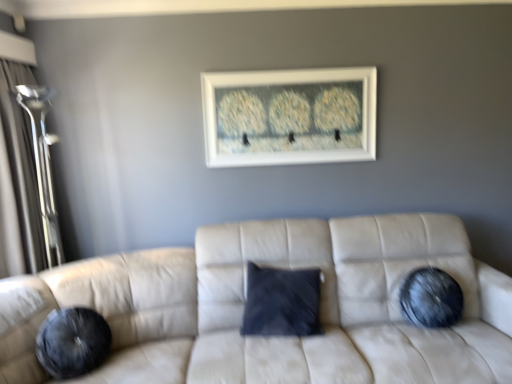
Question: Is transparent glass door at left oriented towards white matte picture frame at upper center?

Choices:
 (A) yes
 (B) no

Answer: (A)

Question: From the image's perspective, is transparent glass door at left above white matte picture frame at upper center?

Choices:
 (A) yes
 (B) no

Answer: (B)

Question: Is transparent glass door at left to the left of white matte picture frame at upper center from the viewer's perspective?

Choices:
 (A) no
 (B) yes

Answer: (B)

Question: Is transparent glass door at left to the right of white matte picture frame at upper center from the viewer's perspective?

Choices:
 (A) no
 (B) yes

Answer: (A)

Question: Is the position of transparent glass door at left less distant than that of white matte picture frame at upper center?

Choices:
 (A) no
 (B) yes

Answer: (B)

Question: Are transparent glass door at left and white matte picture frame at upper center making contact?

Choices:
 (A) no
 (B) yes

Answer: (A)

Question: Does white matte picture frame at upper center have a lesser height compared to suede beige couch at center?

Choices:
 (A) yes
 (B) no

Answer: (A)

Question: Is white matte picture frame at upper center located outside suede beige couch at center?

Choices:
 (A) no
 (B) yes

Answer: (B)

Question: Considering the relative sizes of white matte picture frame at upper center and suede beige couch at center in the image provided, is white matte picture frame at upper center bigger than suede beige couch at center?

Choices:
 (A) no
 (B) yes

Answer: (A)

Question: From a real-world perspective, is white matte picture frame at upper center located beneath suede beige couch at center?

Choices:
 (A) yes
 (B) no

Answer: (B)

Question: From the image's perspective, would you say white matte picture frame at upper center is positioned over suede beige couch at center?

Choices:
 (A) no
 (B) yes

Answer: (B)

Question: Considering the relative positions of white matte picture frame at upper center and suede beige couch at center in the image provided, is white matte picture frame at upper center to the left of suede beige couch at center from the viewer's perspective?

Choices:
 (A) no
 (B) yes

Answer: (B)

Question: Does transparent glass door at left have a lesser height compared to suede beige couch at center?

Choices:
 (A) yes
 (B) no

Answer: (B)